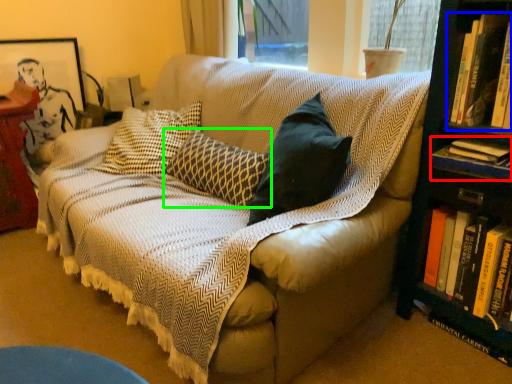
Question: Considering the real-world distances, which object is closest to book (highlighted by a red box)? book (highlighted by a blue box) or pillow (highlighted by a green box).

Choices:
 (A) book
 (B) pillow

Answer: (A)